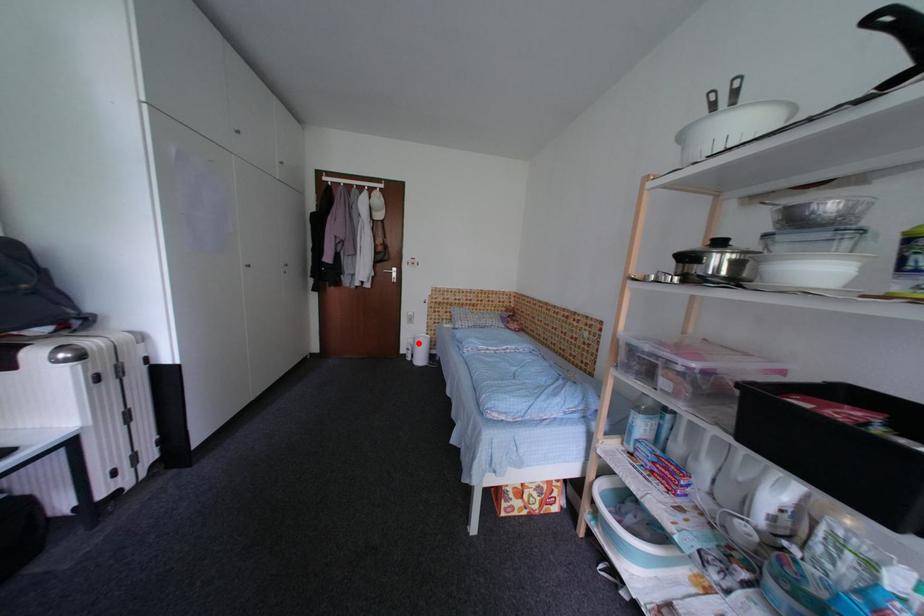
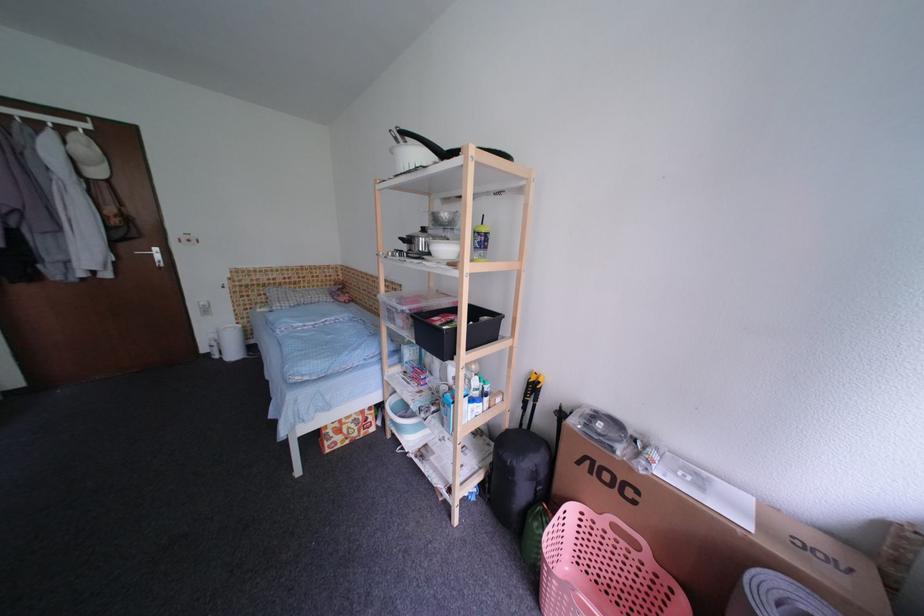
Where in the second image is the point corresponding to the highlighted location from the first image?

(222, 338)